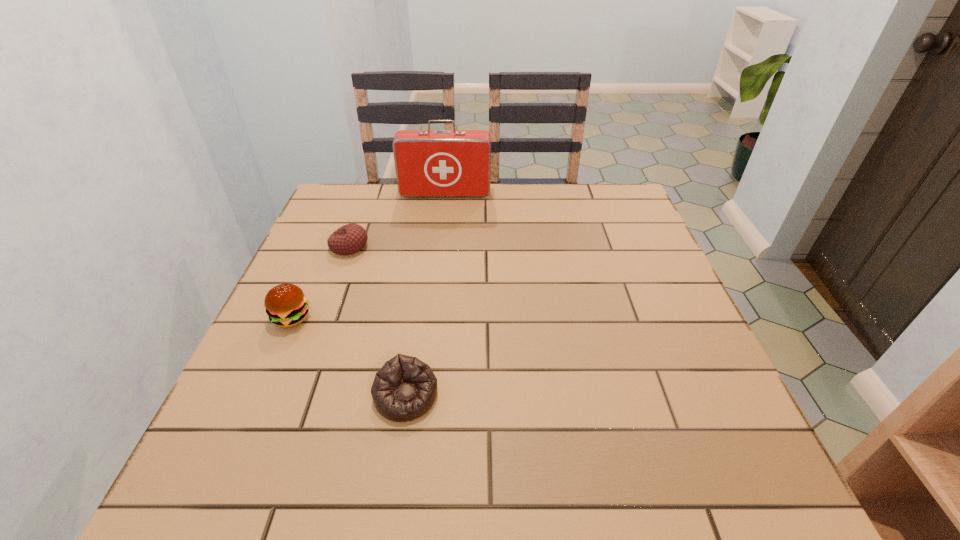
Identify the location of the first-aid kit. (429, 163).

Where is `the farthest object`? This screenshot has width=960, height=540. the farthest object is located at coordinates (429, 163).

You are a GUI agent. You are given a task and a screenshot of the screen. Output one action in this format:
    pyautogui.click(x=<x>, y=<y>)
    Task: Click on the hamburger
    
    Given the screenshot: What is the action you would take?
    pyautogui.click(x=286, y=305)

Locate an element on the screen. The height and width of the screenshot is (540, 960). the third shortest object is located at coordinates (286, 305).

Locate an element on the screen. the second farthest object is located at coordinates (350, 238).

This screenshot has height=540, width=960. What are the coordinates of `the farther beanbag` in the screenshot? It's located at (350, 238).

I want to click on the nearest object, so click(x=405, y=388).

Identify the location of the nearer beanbag. The image size is (960, 540). (405, 388).

Where is `free space located 0.350m on the side of the first-aid kit with the first aid cross symbol`? free space located 0.350m on the side of the first-aid kit with the first aid cross symbol is located at coordinates (436, 274).

At what (x,y) coordinates should I click in order to perform the action: click on free space located 0.230m on the right of the third farthest object. Please return your answer as a coordinate pair (x, y). Looking at the image, I should click on (417, 318).